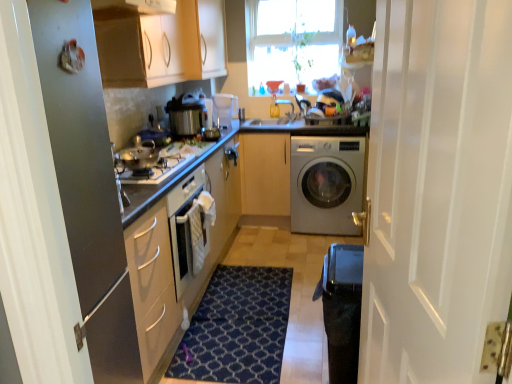
Find the location of a particular element. The height and width of the screenshot is (384, 512). free point below shiny metallic pan at center-left, which is the first appliance from left to right (from a real-world perspective) is located at coordinates click(138, 167).